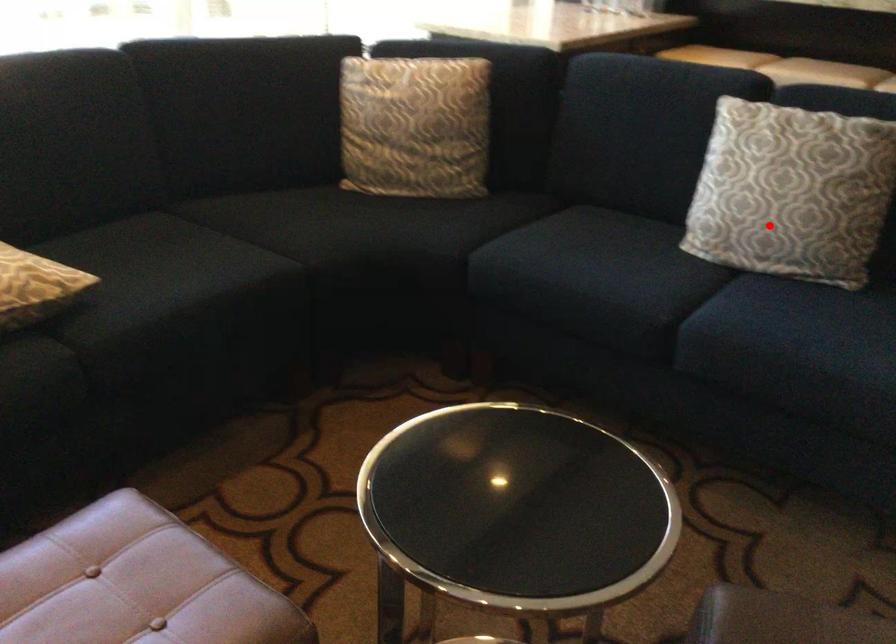
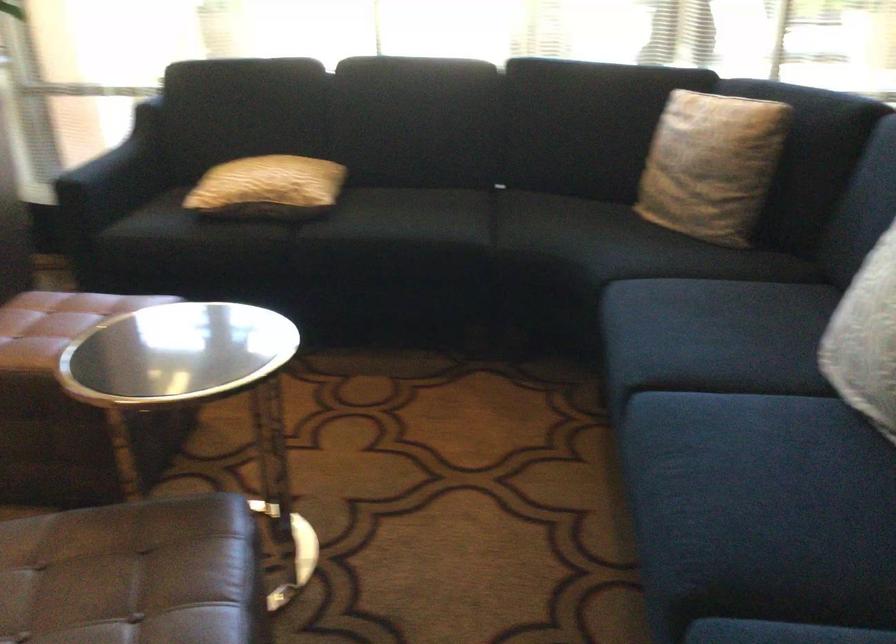
Question: I am providing you with two images of the same scene from different viewpoints. In image1, a red point is highlighted. Considering the same 3D point in image2, which of the following is correct?

Choices:
 (A) It is closer
 (B) It is farther

Answer: (A)